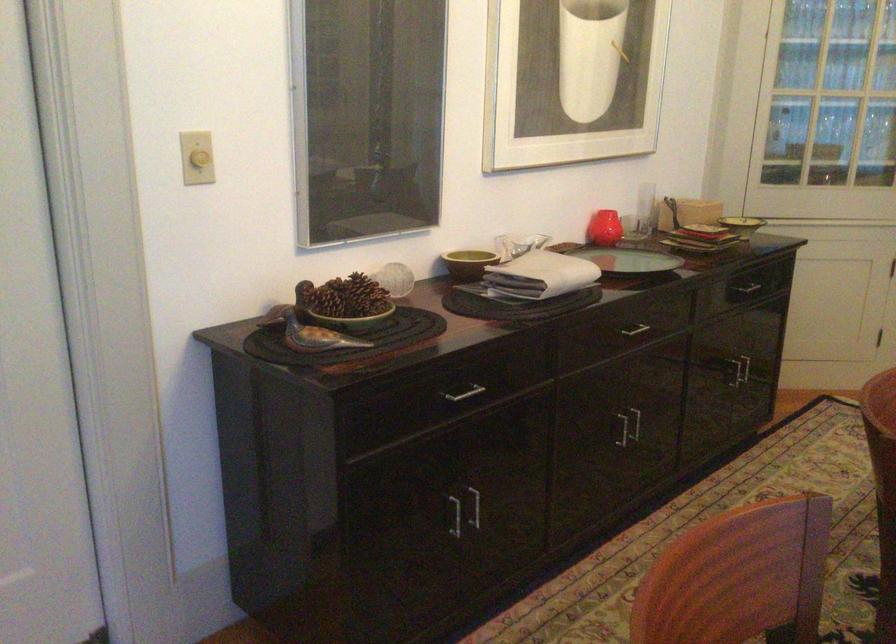
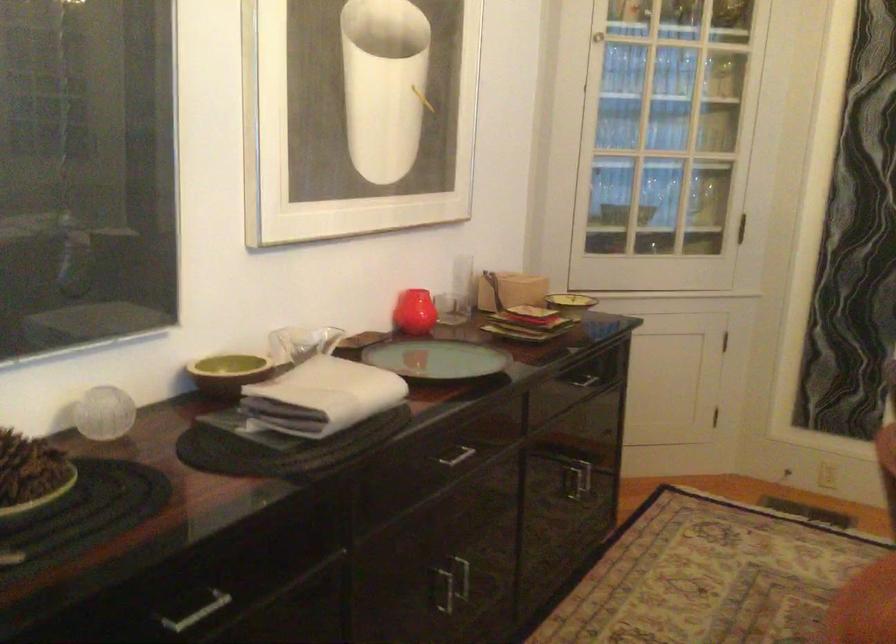
The point at (469,260) is marked in the first image. Where is the corresponding point in the second image?

(228, 373)